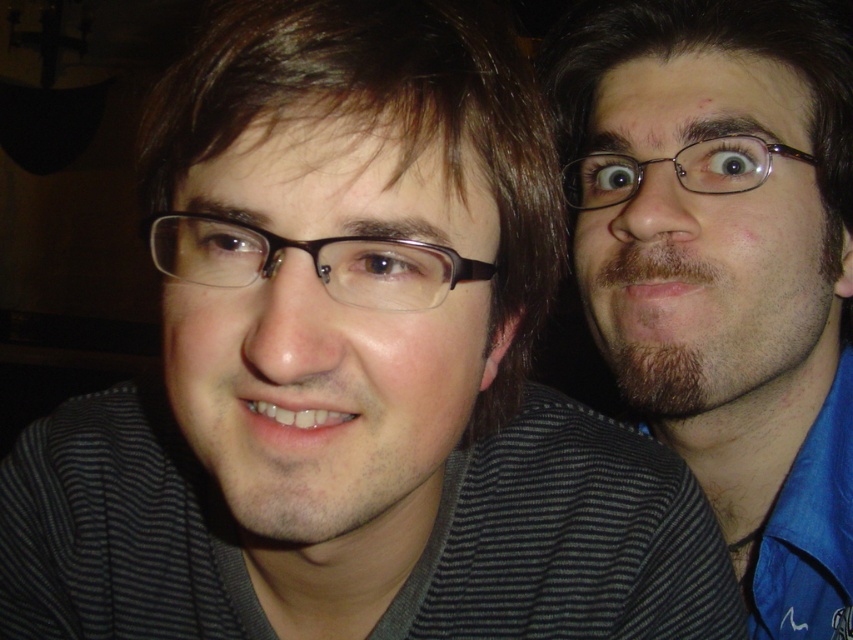
Question: Is brown hair at upper right smaller than matte brown glasses at center?

Choices:
 (A) yes
 (B) no

Answer: (B)

Question: Which of these objects is positioned closest to the matte brown glasses at center?

Choices:
 (A) black plastic glasses at upper right
 (B) brown hair at upper right

Answer: (A)

Question: Can you confirm if brown hair at upper right is positioned to the left of matte brown glasses at center?

Choices:
 (A) yes
 (B) no

Answer: (B)

Question: Which point appears closest to the camera in this image?

Choices:
 (A) (358, 244)
 (B) (811, 161)

Answer: (A)

Question: Which point is farther from the camera taking this photo?

Choices:
 (A) (186, 250)
 (B) (714, 177)

Answer: (B)

Question: Can you confirm if matte brown glasses at center is smaller than black plastic glasses at upper right?

Choices:
 (A) yes
 (B) no

Answer: (A)